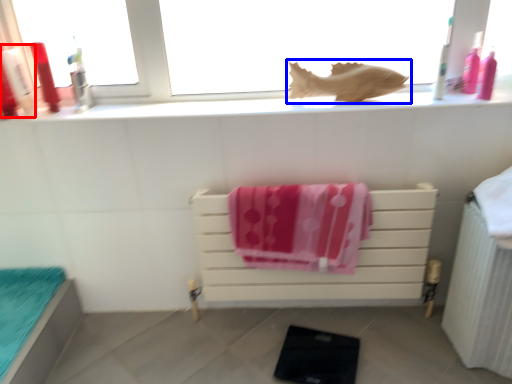
Question: Which object appears closest to the camera in this image, toiletry (highlighted by a red box) or animal (highlighted by a blue box)?

Choices:
 (A) toiletry
 (B) animal

Answer: (A)